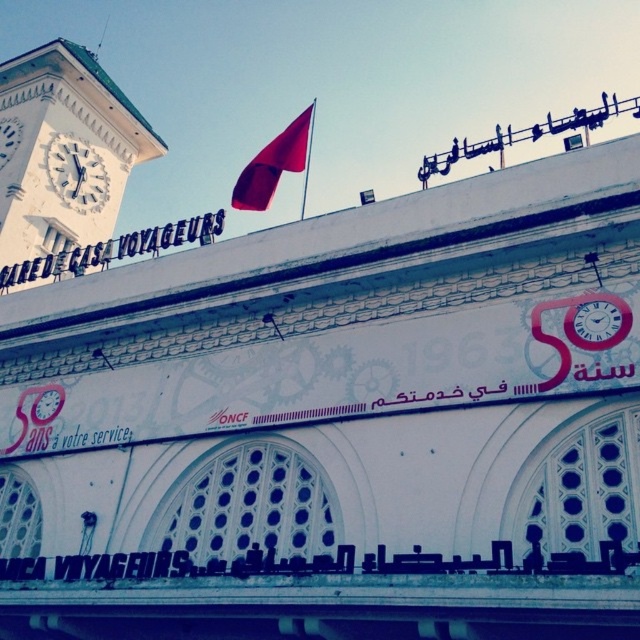
Between white matte clock at upper left and white clock face at upper left, which one is positioned higher?

white clock face at upper left

Is point (65, 186) positioned before point (1, 124)?

That is True.

Locate an element on the screen. The height and width of the screenshot is (640, 640). white matte clock at upper left is located at coordinates (76, 173).

Is white painted stone clock tower at left wider than matte red flag at upper center?

Incorrect, white painted stone clock tower at left's width does not surpass matte red flag at upper center's.

Is white painted stone clock tower at left further to the viewer compared to matte red flag at upper center?

Yes.

Who is more forward, (138, 116) or (257, 186)?

Point (257, 186) is more forward.

Locate an element on the screen. white painted stone clock tower at left is located at coordinates (65, 150).

Who is positioned more to the left, matte red flag at upper center or white matte clock at upper left?

From the viewer's perspective, white matte clock at upper left appears more on the left side.

Who is lower down, matte red flag at upper center or white matte clock at upper left?

white matte clock at upper left is lower down.

Is point (262, 163) positioned behind point (90, 196)?

No, (262, 163) is closer to viewer.

At what (x,y) coordinates should I click in order to perform the action: click on matte red flag at upper center. Please return your answer as a coordinate pair (x, y). Looking at the image, I should click on (275, 164).